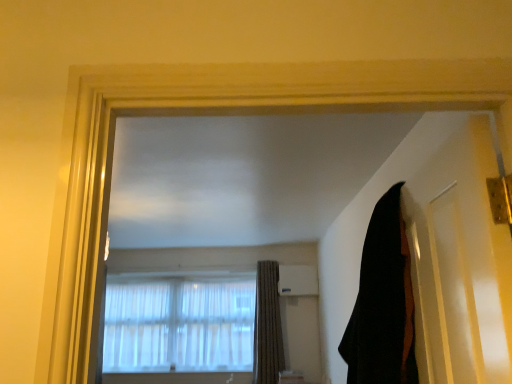
Question: In which direction should I rotate to look at beige textured curtain at center, marked as the 1th curtain in a bottom-to-top arrangement?

Choices:
 (A) left
 (B) right

Answer: (B)

Question: From the image's perspective, is translucent fabric at center under black matte door at right?

Choices:
 (A) no
 (B) yes

Answer: (B)

Question: Would you say translucent fabric at center contains black matte door at right?

Choices:
 (A) no
 (B) yes

Answer: (A)

Question: Is the position of translucent fabric at center less distant than that of black matte door at right?

Choices:
 (A) no
 (B) yes

Answer: (A)

Question: Is translucent fabric at center bigger than black matte door at right?

Choices:
 (A) yes
 (B) no

Answer: (A)

Question: Is translucent fabric at center turned away from black matte door at right?

Choices:
 (A) no
 (B) yes

Answer: (A)

Question: Considering the relative positions of translucent fabric at center and black matte door at right in the image provided, is translucent fabric at center behind black matte door at right?

Choices:
 (A) yes
 (B) no

Answer: (A)

Question: Does black matte door at right appear on the left side of black fabric curtain at right, the first curtain viewed from the right?

Choices:
 (A) no
 (B) yes

Answer: (A)

Question: From the image's perspective, is black matte door at right over black fabric curtain at right, arranged as the first curtain when viewed from the top?

Choices:
 (A) no
 (B) yes

Answer: (B)

Question: Is black matte door at right far away from black fabric curtain at right, the first curtain viewed from the right?

Choices:
 (A) no
 (B) yes

Answer: (A)

Question: Can you confirm if black matte door at right is wider than black fabric curtain at right, which is the first curtain from front to back?

Choices:
 (A) yes
 (B) no

Answer: (B)

Question: Is black matte door at right oriented away from black fabric curtain at right, which is the first curtain from front to back?

Choices:
 (A) yes
 (B) no

Answer: (B)

Question: Can you confirm if black matte door at right is bigger than black fabric curtain at right, which ranks as the 2th curtain in bottom-to-top order?

Choices:
 (A) no
 (B) yes

Answer: (A)

Question: Is black matte door at right closer to the viewer compared to translucent fabric at center?

Choices:
 (A) yes
 (B) no

Answer: (A)